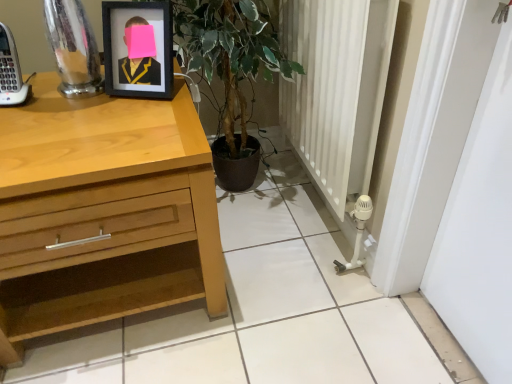
At what (x,y) coordinates should I click in order to perform the action: click on spots to the right of light wood chest of drawers at left. Please return your answer as a coordinate pair (x, y). Looking at the image, I should click on (291, 302).